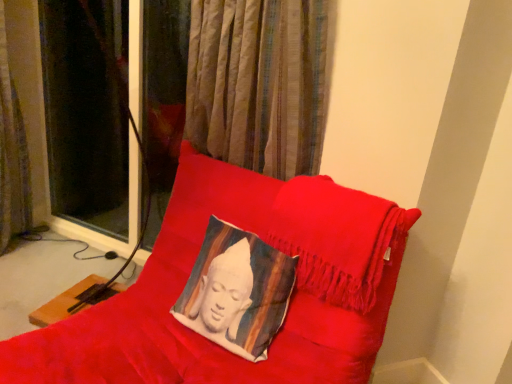
Question: Is velvet cushion at center at the right side of brown textured curtain at left?

Choices:
 (A) no
 (B) yes

Answer: (B)

Question: Is velvet cushion at center facing away from brown textured curtain at left?

Choices:
 (A) yes
 (B) no

Answer: (B)

Question: Can brown textured curtain at left be found inside velvet cushion at center?

Choices:
 (A) yes
 (B) no

Answer: (B)

Question: From a real-world perspective, does velvet cushion at center sit lower than brown textured curtain at left?

Choices:
 (A) yes
 (B) no

Answer: (A)

Question: Does velvet cushion at center come behind brown textured curtain at left?

Choices:
 (A) no
 (B) yes

Answer: (A)

Question: Can you confirm if velvet cushion at center is taller than brown textured curtain at left?

Choices:
 (A) yes
 (B) no

Answer: (B)

Question: Considering the relative sizes of brown textured curtain at left and velvet cushion at center in the image provided, is brown textured curtain at left wider than velvet cushion at center?

Choices:
 (A) no
 (B) yes

Answer: (A)

Question: Is brown textured curtain at left oriented towards velvet cushion at center?

Choices:
 (A) yes
 (B) no

Answer: (B)

Question: Is brown textured curtain at left to the left of velvet cushion at center from the viewer's perspective?

Choices:
 (A) yes
 (B) no

Answer: (A)

Question: Can you confirm if brown textured curtain at left is positioned to the right of velvet cushion at center?

Choices:
 (A) no
 (B) yes

Answer: (A)

Question: Is brown textured curtain at left thinner than velvet cushion at center?

Choices:
 (A) no
 (B) yes

Answer: (B)

Question: Considering the relative sizes of brown textured curtain at left and velvet cushion at center in the image provided, is brown textured curtain at left taller than velvet cushion at center?

Choices:
 (A) yes
 (B) no

Answer: (A)

Question: Is brown textured curtain at left positioned in front of silky white cushion at center?

Choices:
 (A) yes
 (B) no

Answer: (B)